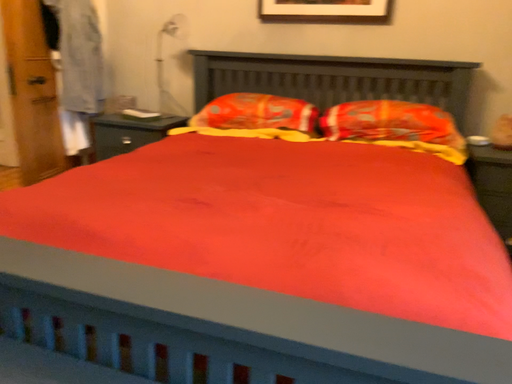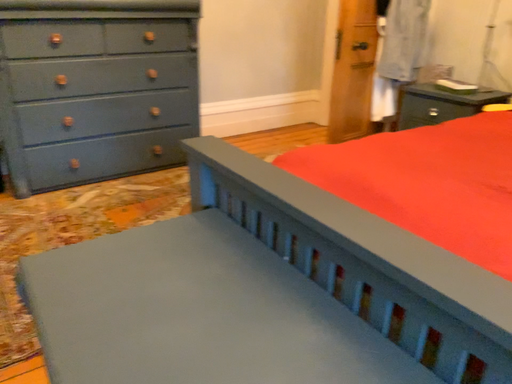
Question: How did the camera likely rotate when shooting the video?

Choices:
 (A) rotated left
 (B) rotated right

Answer: (A)